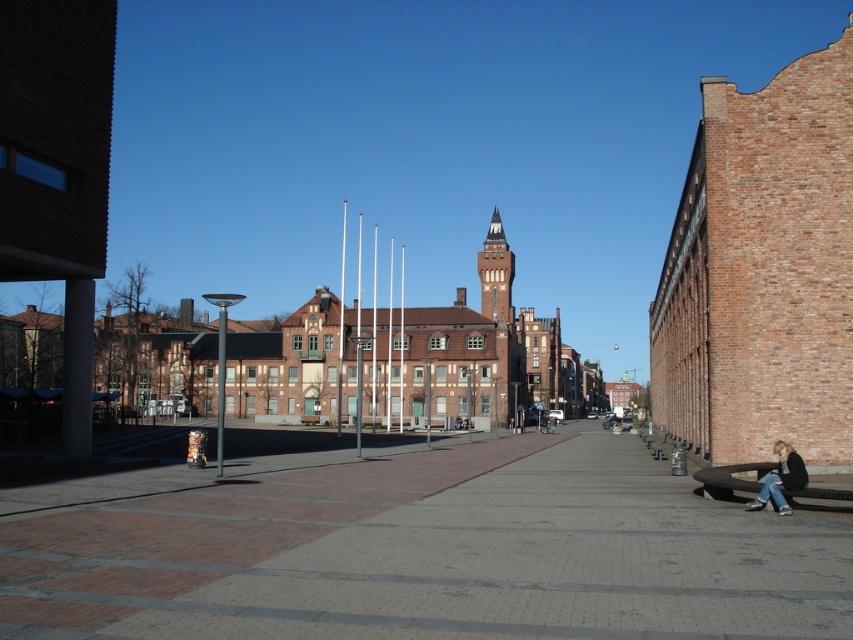
Does brick pavement at center appear over denim jeans at lower right?

No.

Who is taller, brick pavement at center or denim jeans at lower right?

brick pavement at center

Is point (7, 513) farther from camera compared to point (781, 513)?

No, (7, 513) is in front of (781, 513).

Locate an element on the screen. The width and height of the screenshot is (853, 640). brick pavement at center is located at coordinates click(x=418, y=548).